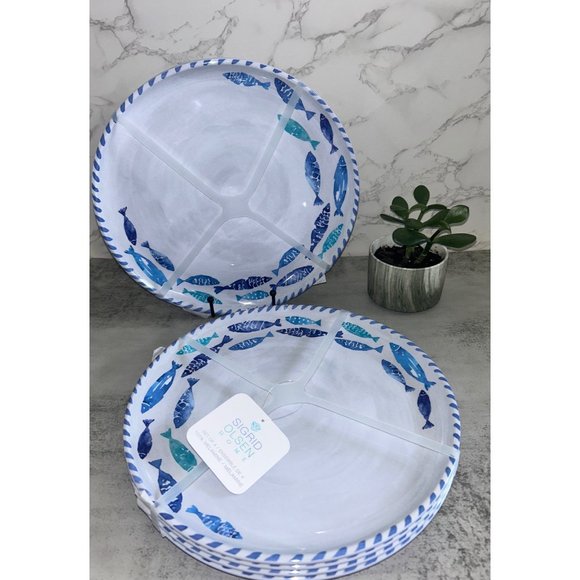
Locate an element on the screen. plates is located at coordinates (125, 186), (150, 387), (338, 572), (342, 561), (356, 554).